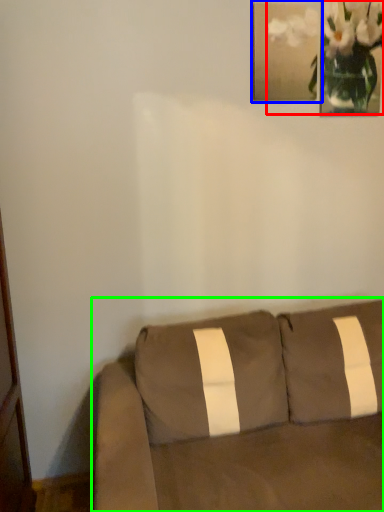
Question: Which object is the farthest from floral arrangement (highlighted by a red box)? Choose among these: picture frame (highlighted by a blue box) or studio couch (highlighted by a green box).

Choices:
 (A) picture frame
 (B) studio couch

Answer: (B)